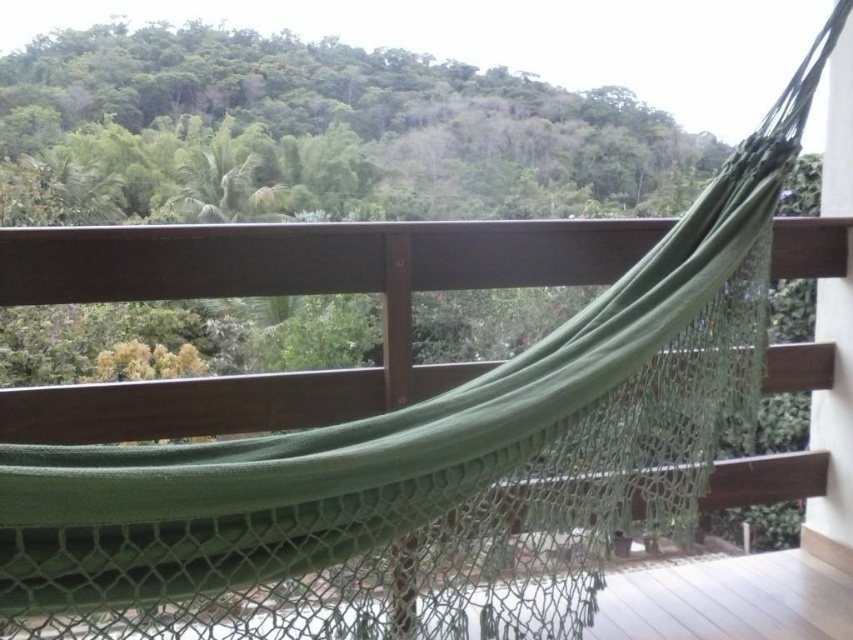
You are standing on the balcony and want to take a photo of both the green leafy tree at upper center and the green mesh hammock at center. Which object should you position to the left side of your camera frame to include both in the photo?

You should position the green leafy tree at upper center to the left side of your camera frame since it is already located to the left of the green mesh hammock at center in the scene.

You are planning to hang a new plant hanger between the green fabric hammock at center and the green mesh hammock at center. Since you want the plant to be at eye level, which hammock should you attach it to?

The green fabric hammock at center is much taller than the green mesh hammock at center, so attaching the plant hanger to the green fabric hammock at center would place the plant at a higher position, closer to eye level.

You are standing on the balcony and want to know if the green leafy tree at upper center can provide shade over the green mesh hammock at center. Based on their sizes, is this possible?

The green leafy tree at upper center has a larger size compared to green mesh hammock at center, so it is possible that the tree can provide shade over the green mesh hammock at center.